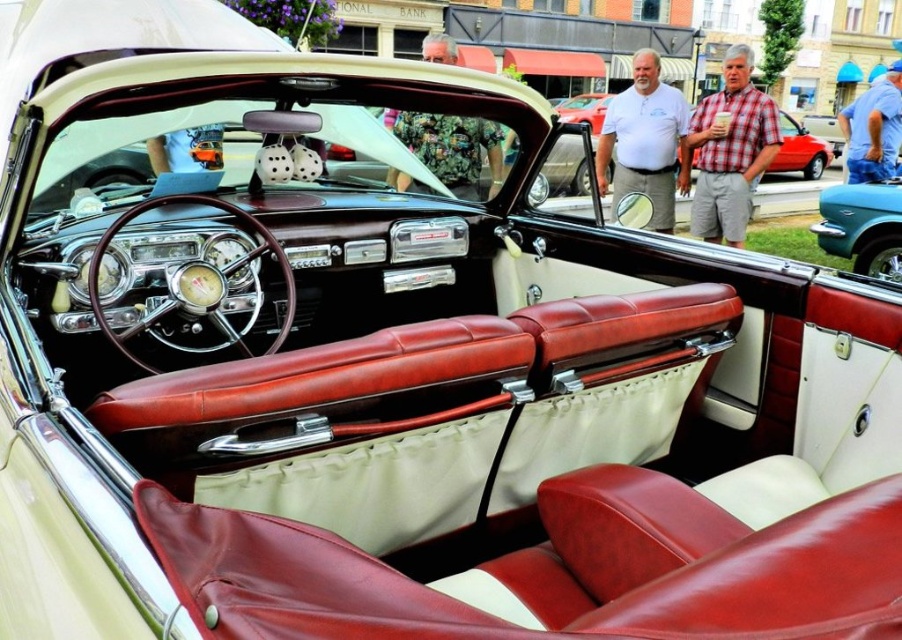
Question: Among these objects, which one is farthest from the camera?

Choices:
 (A) teal metallic car at right
 (B) white cotton shirt at center
 (C) plaid shirt at upper right
 (D) matte red leather car at center

Answer: (A)

Question: Does white cotton shirt at center come in front of matte red leather car at center?

Choices:
 (A) no
 (B) yes

Answer: (A)

Question: Among these points, which one is nearest to the camera?

Choices:
 (A) (757, 97)
 (B) (873, 150)
 (C) (642, 148)

Answer: (A)

Question: Is the position of white cotton shirt at center more distant than that of teal metallic car at right?

Choices:
 (A) yes
 (B) no

Answer: (B)

Question: Which of the following is the closest to the observer?

Choices:
 (A) (835, 243)
 (B) (812, 147)

Answer: (A)

Question: Observing the image, what is the correct spatial positioning of white cotton shirt at center in reference to camouflage fabric shirt at upper center?

Choices:
 (A) left
 (B) right

Answer: (B)